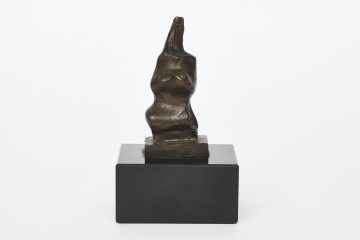
Locate an element on the screen. The height and width of the screenshot is (240, 360). bronze statue is located at coordinates (176, 106).